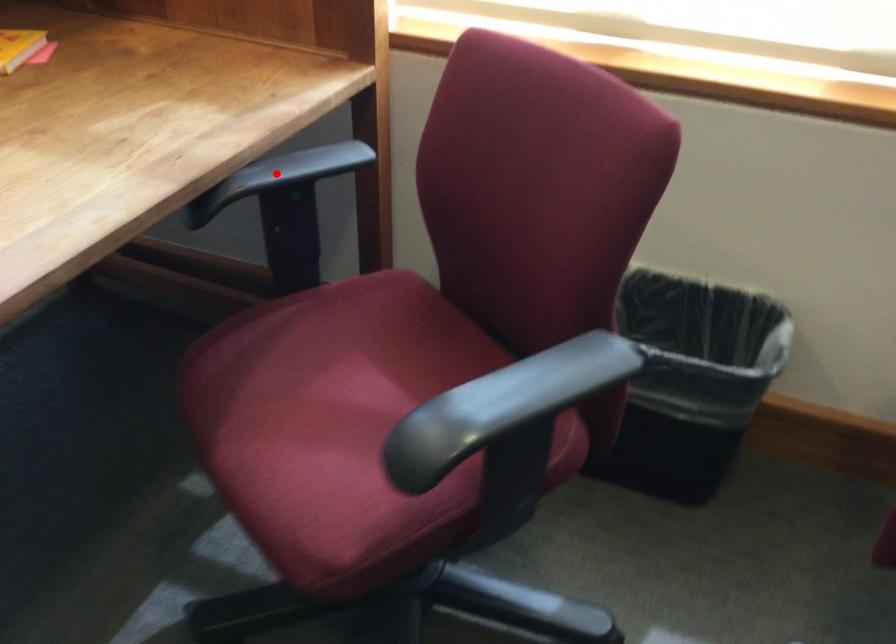
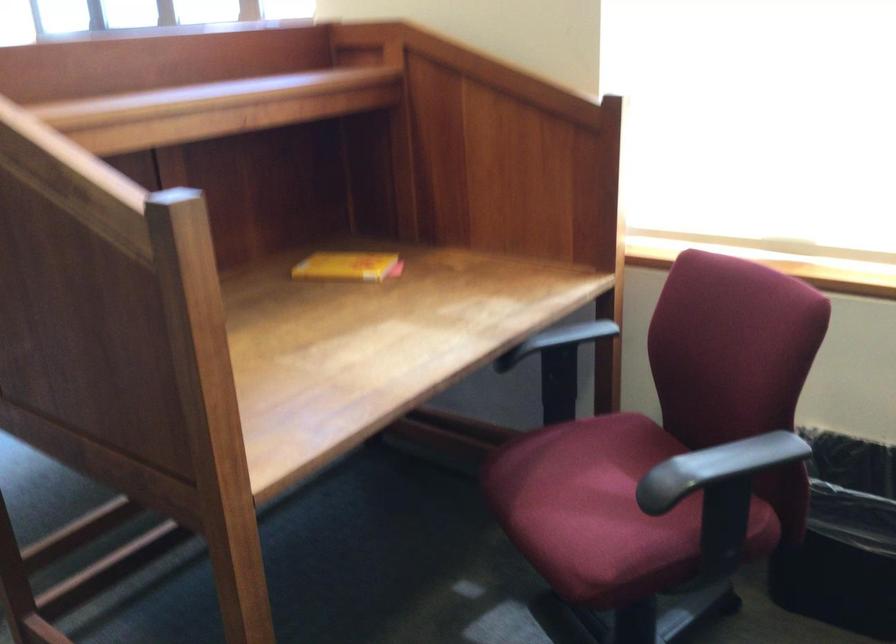
Question: A red point is marked in image1. In image2, is the corresponding 3D point closer to the camera or farther? Reply with the corresponding letter.

Choices:
 (A) The corresponding 3D point is closer.
 (B) The corresponding 3D point is farther.

Answer: (B)